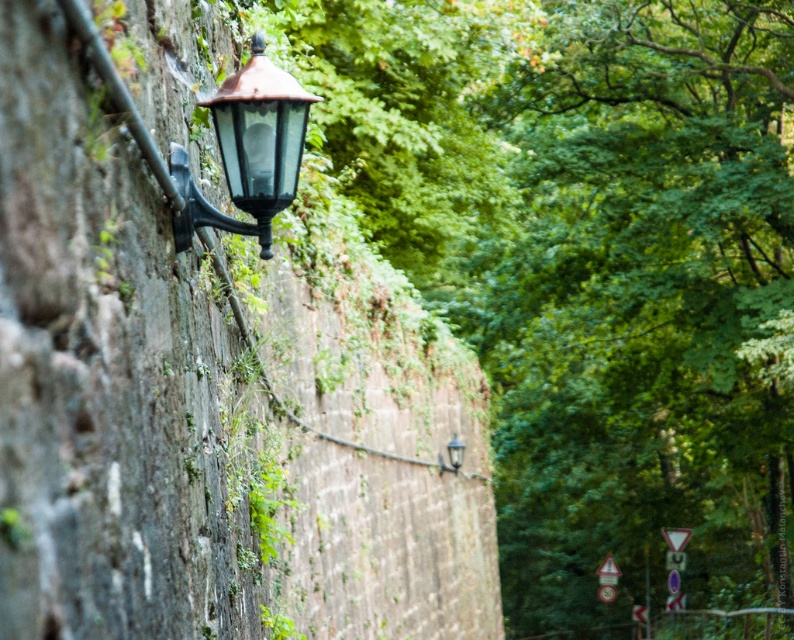
In the scene shown: You are standing in front of the stone wall with the vintage street lamp. There is a point marked at coordinates (588, 266). What does this point indicate?

The point at (588, 266) marks the location of the green leafy tree at upper left.

You are standing in front of the stone wall and notice both the green leafy tree at upper left and the matte black lamp at upper left. From your perspective, which object is positioned to the right?

The green leafy tree at upper left is positioned to the right of the matte black lamp at upper left.